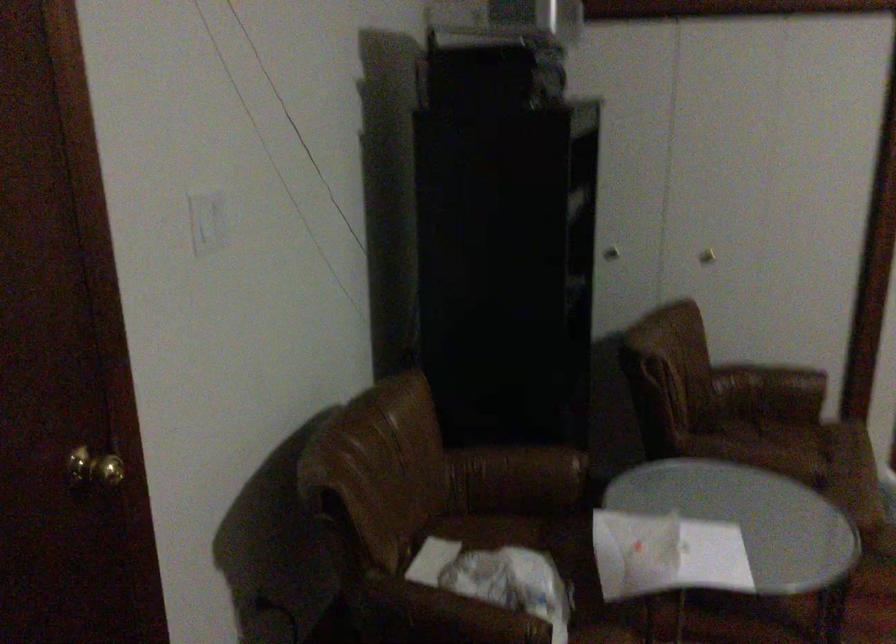
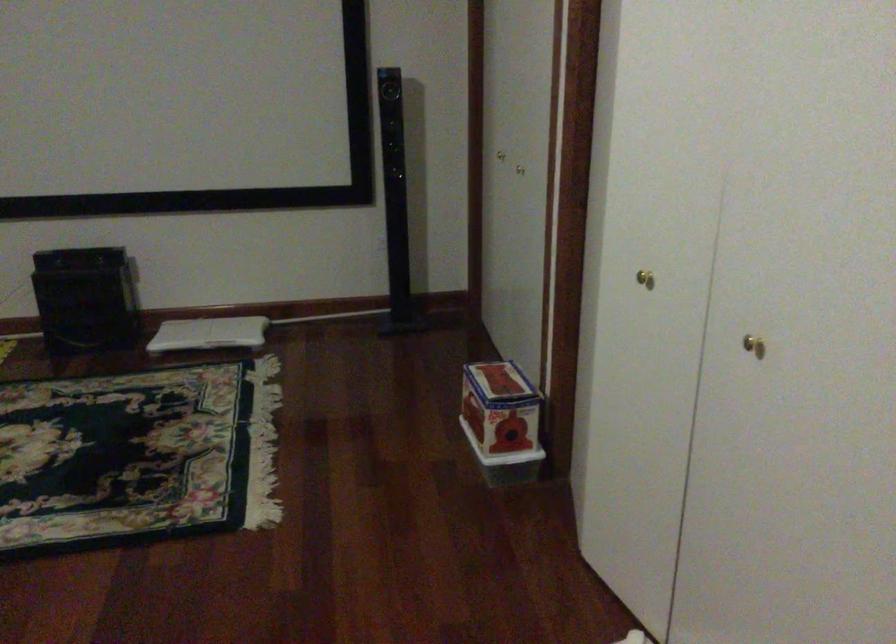
How did the camera likely rotate?

The rotation direction of the camera is right-down.